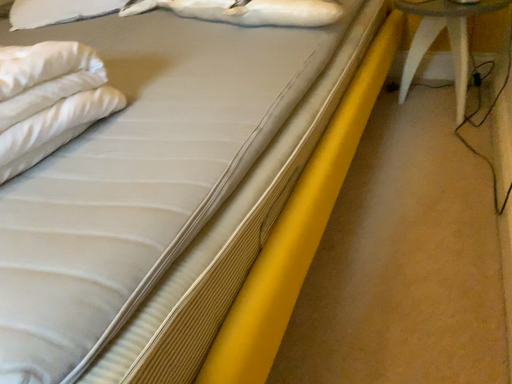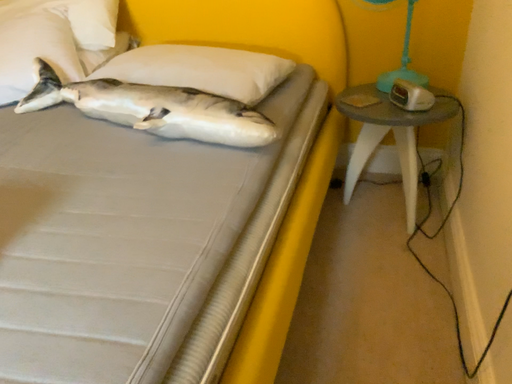
Question: How did the camera likely rotate when shooting the video?

Choices:
 (A) rotated right
 (B) rotated left

Answer: (A)